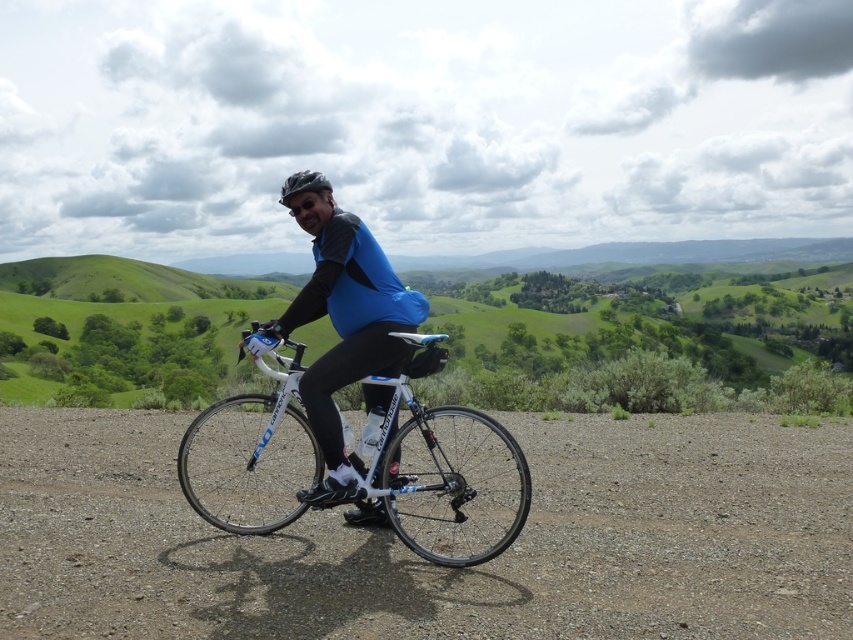
Between white glossy bicycle at center and matte black helmet at center, which one is positioned lower?

white glossy bicycle at center

Does point (431, 557) come behind point (317, 176)?

No, it is in front of (317, 176).

Is point (524, 488) less distant than point (279, 202)?

Yes, it is.

This screenshot has height=640, width=853. Find the location of `white glossy bicycle at center`. white glossy bicycle at center is located at coordinates (451, 476).

Looking at this image, who is more distant from viewer, (0, 595) or (253, 467)?

Positioned behind is point (253, 467).

Who is more distant from viewer, [236,632] or [221,493]?

Positioned behind is point [221,493].

Image resolution: width=853 pixels, height=640 pixels. Find the location of `gray gravel dirt track at center`. gray gravel dirt track at center is located at coordinates (430, 564).

Is point (73, 340) positioned after point (332, 272)?

Yes, point (73, 340) is behind point (332, 272).

Is point (672, 296) less distant than point (270, 323)?

No, (672, 296) is further to viewer.

The image size is (853, 640). What are the coordinates of `green grassy hillside at center` in the screenshot? It's located at (636, 330).